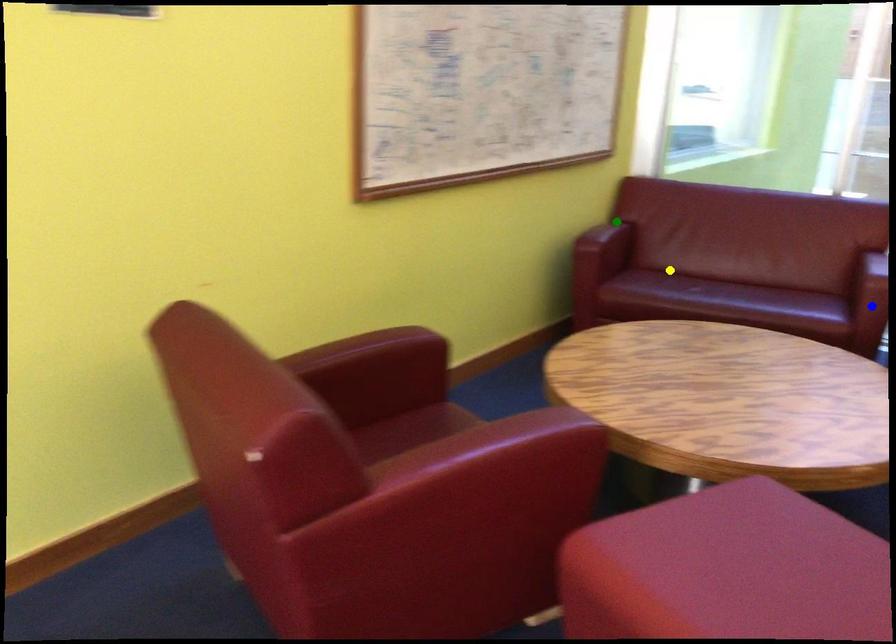
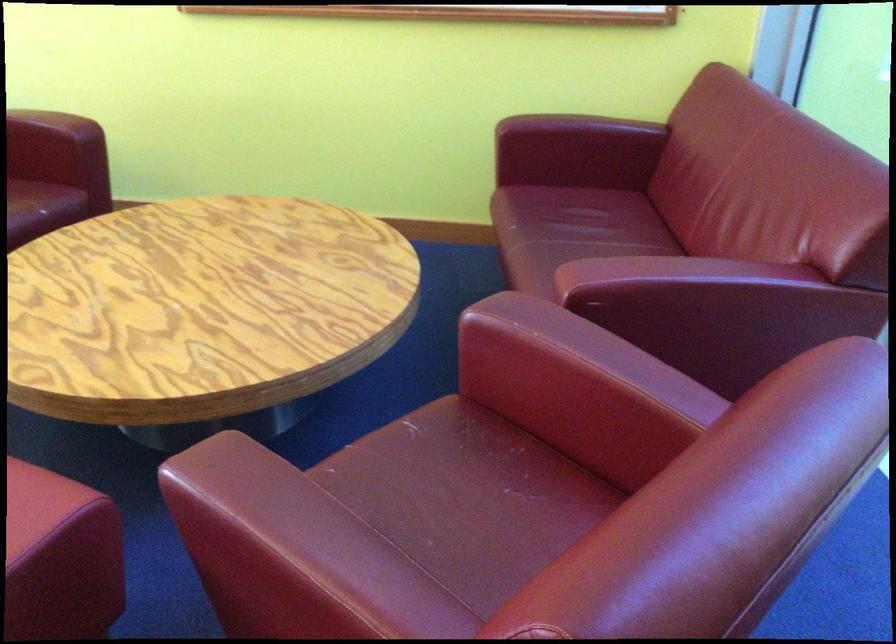
I am providing you with two images of the same scene from different viewpoints. Three points are marked in image1. Which point corresponds to a part or object that is occluded in image2?In image1, three points are marked. Which of them correspond to a part or object that is occluded in image2?Among the three points shown in image1, which one corresponds to a part or object that is no longer visible due to occlusion in image2?

Invisible in image2: blue point.